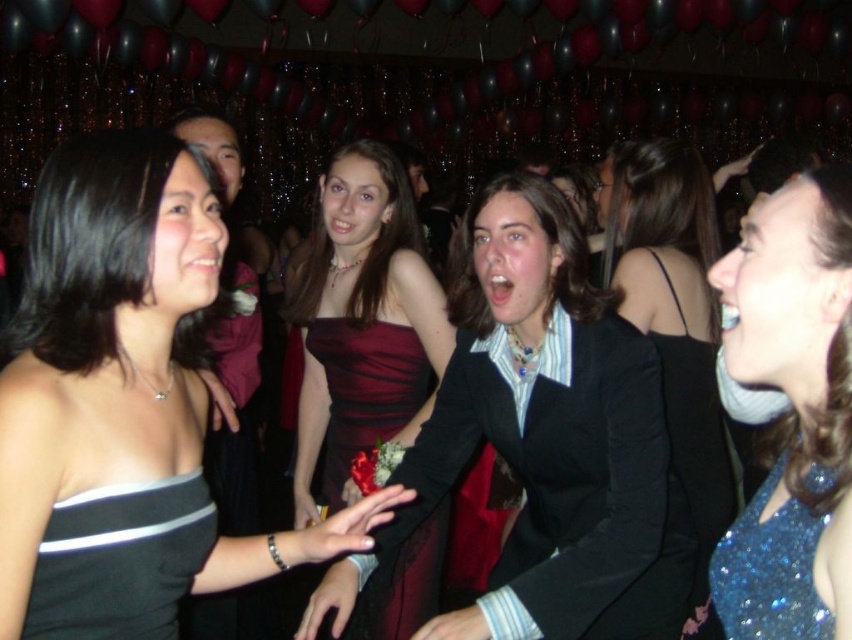
Is black satin dress at left smaller than sparkly blue dress at lower right?

Incorrect, black satin dress at left is not smaller in size than sparkly blue dress at lower right.

Which of these two, black satin dress at left or sparkly blue dress at lower right, stands shorter?

sparkly blue dress at lower right is shorter.

Between point (96, 512) and point (767, 529), which one is positioned behind?

Positioned behind is point (96, 512).

You are a GUI agent. You are given a task and a screenshot of the screen. Output one action in this format:
    pyautogui.click(x=<x>, y=<y>)
    Task: Click on the black satin dress at left
    The image size is (852, 640).
    Given the screenshot: What is the action you would take?
    pyautogui.click(x=119, y=561)

Can you confirm if black satin dress at upper left is positioned to the left of black satin dress at center?

Yes, black satin dress at upper left is to the left of black satin dress at center.

How much distance is there between black satin dress at upper left and black satin dress at center?

black satin dress at upper left is 3.79 feet from black satin dress at center.

Where is `black satin dress at upper left`? The height and width of the screenshot is (640, 852). black satin dress at upper left is located at coordinates (122, 381).

Which is above, sparkly blue dress at upper right or burgundy satin dress at center?

Positioned higher is sparkly blue dress at upper right.

Is sparkly blue dress at upper right bigger than burgundy satin dress at center?

Incorrect, sparkly blue dress at upper right is not larger than burgundy satin dress at center.

Is point (812, 468) positioned after point (371, 342)?

That is False.

The width and height of the screenshot is (852, 640). I want to click on sparkly blue dress at upper right, so click(x=793, y=413).